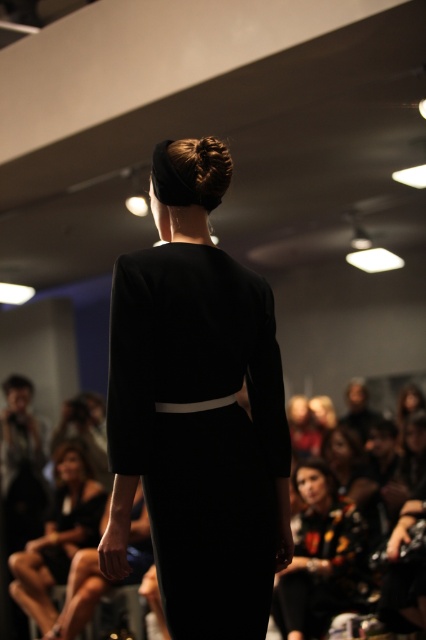
Does black satin dress at center have a greater height compared to matte black dress at center?

No, black satin dress at center is not taller than matte black dress at center.

Who is higher up, black satin dress at center or matte black dress at center?

black satin dress at center

Measure the distance between point (181,516) and camera.

They are 6.24 feet apart.

This screenshot has width=426, height=640. I want to click on black satin dress at center, so click(x=199, y=429).

Looking at this image, is floral-patterned fabric at lower center wider than matte black dress at center?

Incorrect, floral-patterned fabric at lower center's width does not surpass matte black dress at center's.

Measure the distance from floral-patterned fabric at lower center to matte black dress at center.

floral-patterned fabric at lower center is 1.76 meters from matte black dress at center.

Where is `floral-patterned fabric at lower center`? This screenshot has height=640, width=426. floral-patterned fabric at lower center is located at coordinates (322, 556).

Is point (129, 353) farther from camera compared to point (313, 596)?

No, it is not.

At what (x,y) coordinates should I click in order to perform the action: click on black satin dress at center. Please return your answer as a coordinate pair (x, y). The width and height of the screenshot is (426, 640). Looking at the image, I should click on (199, 429).